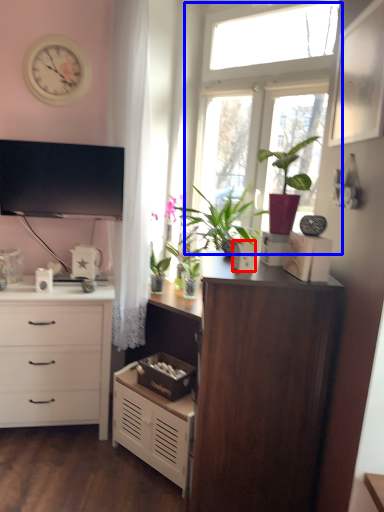
Question: Which of the following is the farthest to the observer, appliance (highlighted by a red box) or window (highlighted by a blue box)?

Choices:
 (A) appliance
 (B) window

Answer: (B)